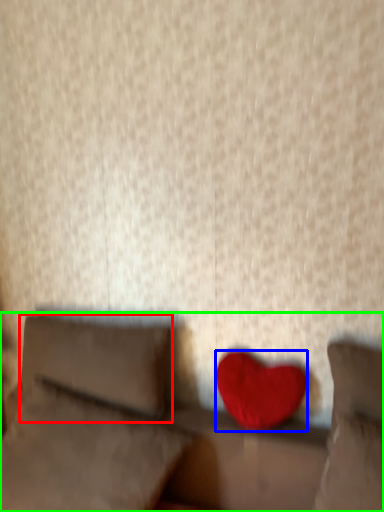
Question: Which object is positioned closest to pillow (highlighted by a red box)? Select from heart (highlighted by a blue box) and furniture (highlighted by a green box).

Choices:
 (A) heart
 (B) furniture

Answer: (B)